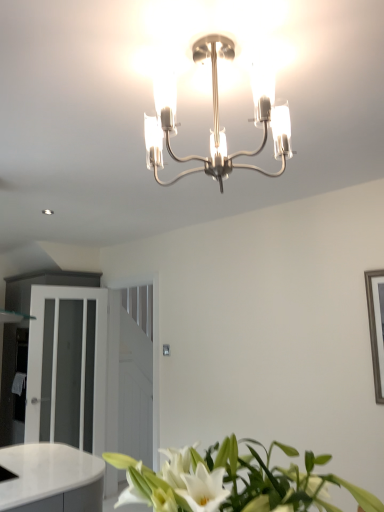
Based on the photo, in order to face white glossy leaves at lower center, should I rotate leftwards or rightwards?

A 6.454 degree turn to the right will do.

Describe the element at coordinates (84, 365) in the screenshot. This screenshot has height=512, width=384. I see `white glossy dresser at left` at that location.

Identify the location of white frosted glass door at left. (67, 367).

You are a GUI agent. You are given a task and a screenshot of the screen. Output one action in this format:
    pyautogui.click(x=<x>, y=<y>)
    Task: Click on the white glossy leaves at lower center
    This screenshot has width=384, height=512.
    Given the screenshot: What is the action you would take?
    pyautogui.click(x=231, y=481)

Which of these two, polished chrome chandelier at center or white glossy leaves at lower center, is bigger?

With larger size is white glossy leaves at lower center.

Is polished chrome chandelier at center at the left side of white glossy leaves at lower center?

Correct, you'll find polished chrome chandelier at center to the left of white glossy leaves at lower center.

Would you say polished chrome chandelier at center is inside or outside white glossy leaves at lower center?

polished chrome chandelier at center is spatially situated outside white glossy leaves at lower center.

What's the angular difference between polished chrome chandelier at center and white glossy leaves at lower center's facing directions?

They differ by 1.01 degrees in their facing directions.

Who is taller, polished chrome chandelier at center or white glossy dresser at left?

Standing taller between the two is white glossy dresser at left.

Can you confirm if polished chrome chandelier at center is thinner than white glossy dresser at left?

Indeed, polished chrome chandelier at center has a lesser width compared to white glossy dresser at left.

Is polished chrome chandelier at center in contact with white glossy dresser at left?

No, polished chrome chandelier at center is not with white glossy dresser at left.

Is polished chrome chandelier at center to the left of white glossy dresser at left from the viewer's perspective?

In fact, polished chrome chandelier at center is to the right of white glossy dresser at left.

Relative to polished chrome chandelier at center, is white glossy dresser at left in front or behind?

white glossy dresser at left is behind polished chrome chandelier at center.

Is white glossy dresser at left spatially inside polished chrome chandelier at center, or outside of it?

The correct answer is: outside.

From a real-world perspective, which object stands above the other?

In real-world perspective, polished chrome chandelier at center is above.

From the image's perspective, is white glossy dresser at left located beneath polished chrome chandelier at center?

Yes, from the image's perspective, white glossy dresser at left is beneath polished chrome chandelier at center.

In terms of width, does white frosted glass door at left look wider or thinner when compared to polished chrome chandelier at center?

In the image, white frosted glass door at left appears to be more narrow than polished chrome chandelier at center.

Is white frosted glass door at left placed right next to polished chrome chandelier at center?

No, white frosted glass door at left is not with polished chrome chandelier at center.

In the scene shown: Considering the relative sizes of white frosted glass door at left and polished chrome chandelier at center in the image provided, is white frosted glass door at left shorter than polished chrome chandelier at center?

Incorrect, the height of white frosted glass door at left does not fall short of that of polished chrome chandelier at center.

Considering the sizes of objects white frosted glass door at left and polished chrome chandelier at center in the image provided, who is smaller, white frosted glass door at left or polished chrome chandelier at center?

polished chrome chandelier at center.

Who is smaller, white glossy dresser at left or white glossy leaves at lower center?

With smaller size is white glossy leaves at lower center.

Is white glossy dresser at left outside of white glossy leaves at lower center?

Yes, white glossy dresser at left is outside of white glossy leaves at lower center.

From a real-world perspective, which is physically above, white glossy dresser at left or white glossy leaves at lower center?

white glossy dresser at left is physically above.

Is white glossy leaves at lower center not within white frosted glass door at left?

Yes, white glossy leaves at lower center is not within white frosted glass door at left.

Does white glossy leaves at lower center appear on the right side of white frosted glass door at left?

Correct, you'll find white glossy leaves at lower center to the right of white frosted glass door at left.

From a real-world perspective, who is located higher, white glossy leaves at lower center or white frosted glass door at left?

white glossy leaves at lower center.

Is white glossy leaves at lower center not close to white frosted glass door at left?

Yes.

Is white glossy leaves at lower center facing towards white glossy dresser at left?

Yes.

Does white glossy leaves at lower center have a larger size compared to white glossy dresser at left?

No, white glossy leaves at lower center is not bigger than white glossy dresser at left.

From a real-world perspective, which object rests below the other?

white glossy leaves at lower center is physically lower.

Is white glossy leaves at lower center placed right next to white glossy dresser at left?

white glossy leaves at lower center and white glossy dresser at left are not in contact.

The image size is (384, 512). Find the location of `lamp above the white glossy leaves at lower center (from a real-world perspective)`. lamp above the white glossy leaves at lower center (from a real-world perspective) is located at coordinates (218, 119).

Locate an element on the screen. This screenshot has height=512, width=384. dresser below the polished chrome chandelier at center (from a real-world perspective) is located at coordinates (84, 365).

Based on their spatial positions, is white glossy leaves at lower center or white glossy dresser at left further from white frosted glass door at left?

Among the two, white glossy leaves at lower center is located further to white frosted glass door at left.

From the image, which object appears to be farther from white frosted glass door at left, polished chrome chandelier at center or white glossy leaves at lower center?

polished chrome chandelier at center.

Estimate the real-world distances between objects in this image. Which object is closer to white glossy leaves at lower center, white frosted glass door at left or polished chrome chandelier at center?

polished chrome chandelier at center is positioned closer to the anchor white glossy leaves at lower center.

Considering their positions, is white frosted glass door at left positioned closer to polished chrome chandelier at center than white glossy dresser at left?

white frosted glass door at left.

Looking at the image, which one is located closer to white glossy leaves at lower center, white glossy dresser at left or white frosted glass door at left?

The object closer to white glossy leaves at lower center is white frosted glass door at left.

Looking at the image, which one is located further to white glossy dresser at left, white glossy leaves at lower center or polished chrome chandelier at center?

polished chrome chandelier at center is further to white glossy dresser at left.

Considering their positions, is white glossy leaves at lower center positioned further to polished chrome chandelier at center than white glossy dresser at left?

Among the two, white glossy dresser at left is located further to polished chrome chandelier at center.

Estimate the real-world distances between objects in this image. Which object is further from white glossy leaves at lower center, white frosted glass door at left or white glossy dresser at left?

white glossy dresser at left is further to white glossy leaves at lower center.

I want to click on glass door between white glossy leaves at lower center and white glossy dresser at left from front to back, so click(67, 367).

Image resolution: width=384 pixels, height=512 pixels. Find the location of `lamp between white glossy leaves at lower center and white glossy dresser at left along the z-axis`. lamp between white glossy leaves at lower center and white glossy dresser at left along the z-axis is located at coordinates (218, 119).

Find the location of a particular element. Image resolution: width=384 pixels, height=512 pixels. glass door between polished chrome chandelier at center and white glossy dresser at left along the z-axis is located at coordinates (67, 367).

This screenshot has height=512, width=384. What are the coordinates of `lamp between white glossy leaves at lower center and white frosted glass door at left from front to back` in the screenshot? It's located at (218, 119).